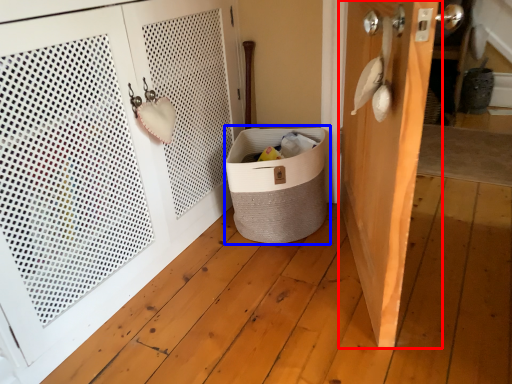
Question: Which of the following is the farthest to the observer, door (highlighted by a red box) or laundry basket (highlighted by a blue box)?

Choices:
 (A) door
 (B) laundry basket

Answer: (B)